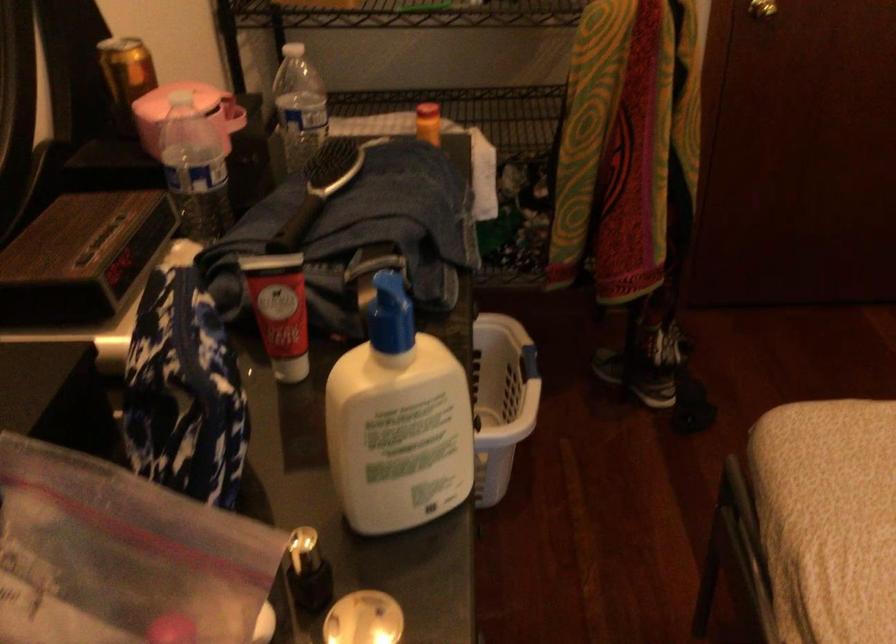
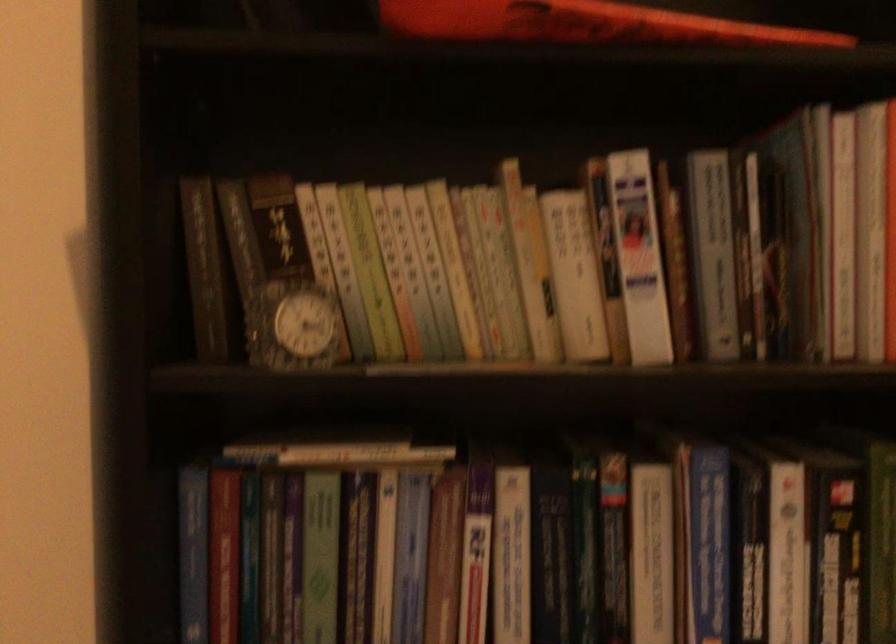
Question: Based on the continuous images, in which direction is the camera rotating? Reply with the corresponding letter.

Choices:
 (A) Left
 (B) Right
 (C) Up
 (D) Down

Answer: (A)